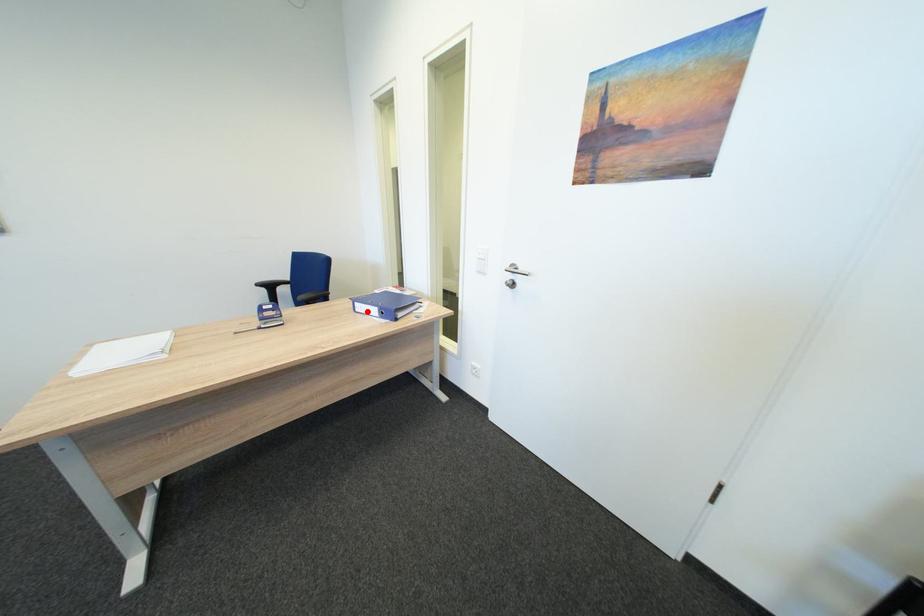
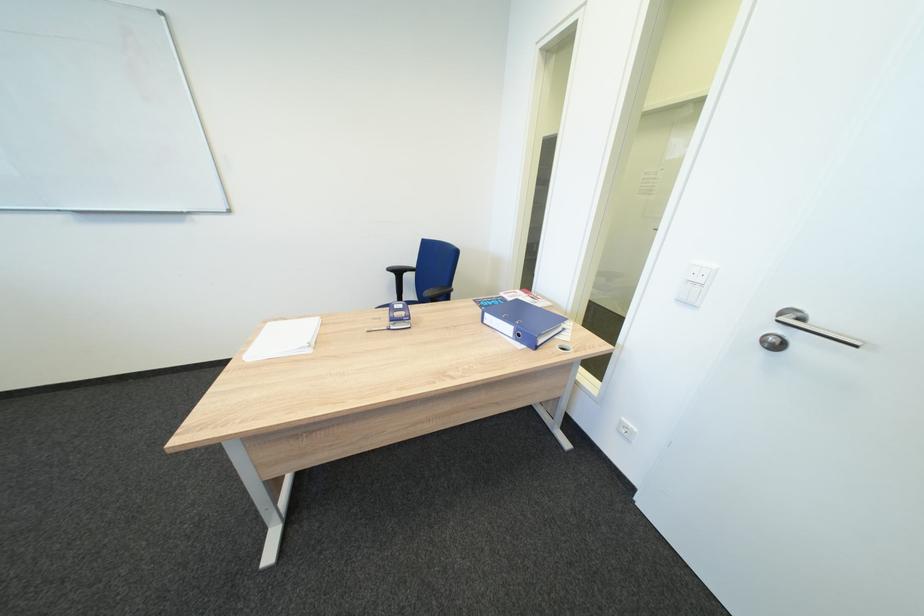
The point at the highlighted location is marked in the first image. Where is the corresponding point in the second image?

(495, 323)